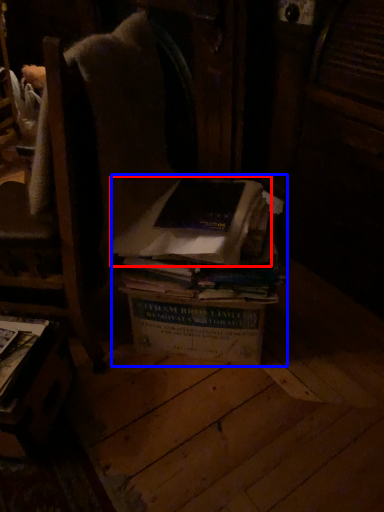
Question: Which object appears farthest to the camera in this image, book (highlighted by a red box) or book (highlighted by a blue box)?

Choices:
 (A) book
 (B) book

Answer: (B)